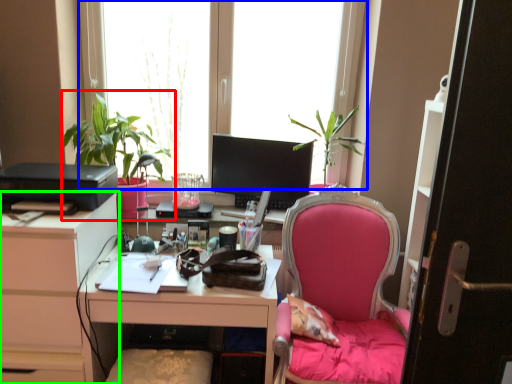
Question: Which object is positioned farthest from houseplant (highlighted by a red box)? Select from window (highlighted by a blue box) and cabinetry (highlighted by a green box).

Choices:
 (A) window
 (B) cabinetry

Answer: (B)